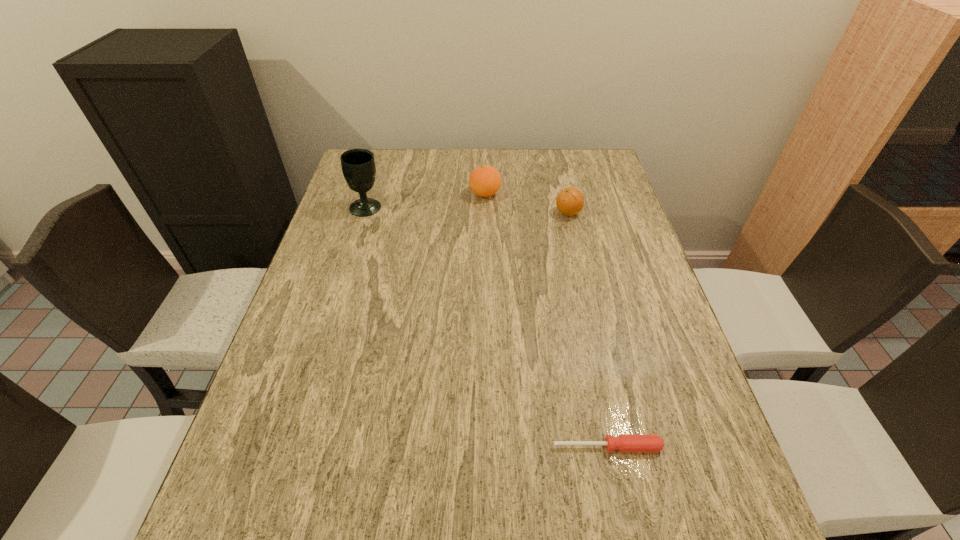
Locate an element on the screen. This screenshot has width=960, height=540. vacant space in between the second object from left to right and the right orange is located at coordinates (527, 204).

Identify which object is the nearest to the shortest object. Please provide its 2D coordinates. Your answer should be formatted as a tuple, i.e. [(x, y)], where the tuple contains the x and y coordinates of a point satisfying the conditions above.

[(570, 201)]

Identify which object is the second closest to the nearest object. Please provide its 2D coordinates. Your answer should be formatted as a tuple, i.e. [(x, y)], where the tuple contains the x and y coordinates of a point satisfying the conditions above.

[(484, 181)]

Find the location of `free spot that satisfies the following two spatial constraints: 1. on the front side of the farther orange; 2. on the left side of the shortest object`. free spot that satisfies the following two spatial constraints: 1. on the front side of the farther orange; 2. on the left side of the shortest object is located at coordinates (489, 447).

I want to click on free region that satisfies the following two spatial constraints: 1. on the back side of the tallest object; 2. on the left side of the farther orange, so click(x=371, y=194).